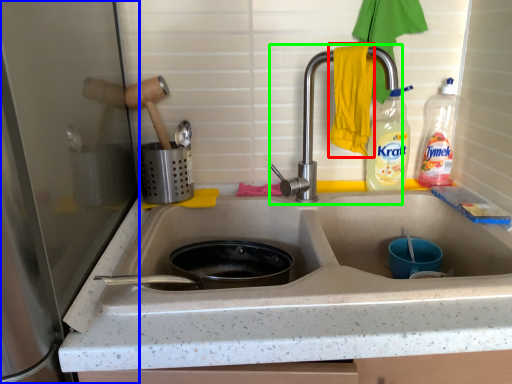
Question: Which is nearer to the hand towel (highlighted by a red box)? appliance (highlighted by a blue box) or tap (highlighted by a green box).

Choices:
 (A) appliance
 (B) tap

Answer: (B)